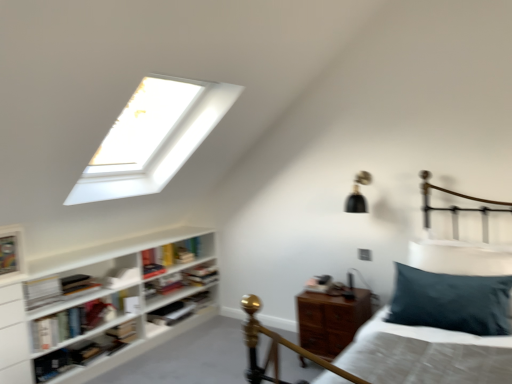
Question: Looking at the image, does hardcover book at center, which is counted as the 6th book, starting from the front, seem bigger or smaller compared to hardcover book at center, placed as the 8th book when sorted from front to back?

Choices:
 (A) small
 (B) big

Answer: (A)

Question: In terms of height, does hardcover book at center, which is counted as the 6th book, starting from the front, look taller or shorter compared to hardcover book at center, placed as the 8th book when sorted from front to back?

Choices:
 (A) short
 (B) tall

Answer: (A)

Question: Which is farther from the white matte bookshelf at lower left, which is the 3th book in front-to-back order?

Choices:
 (A) wooden nightstand at lower right
 (B) hardcover book at lower left, which is the 4th book from front to back
 (C) hardcover book at left, which ranks as the first book in front-to-back order
 (D) hardcover book at center-left, which ranks as the fifth book in front-to-back order
 (E) teal velvet pillow at right

Answer: (E)

Question: Which is farther from the white wooden shelf at left?

Choices:
 (A) black matte lampshade at upper right
 (B) hardcover book at left, which ranks as the first book in front-to-back order
 (C) hardcover book at center-left, which ranks as the fifth book in front-to-back order
 (D) teal velvet pillow at right
 (E) hardcover book at left, the second book positioned from the front

Answer: (D)